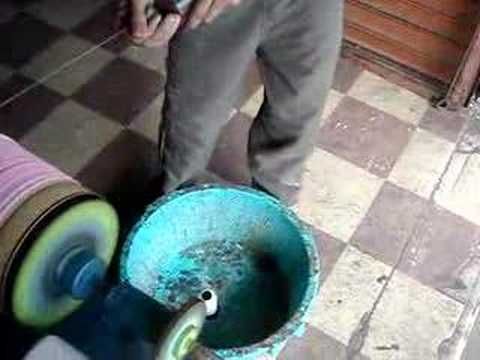
Image resolution: width=480 pixels, height=360 pixels. I want to click on dresser, so click(403, 44).